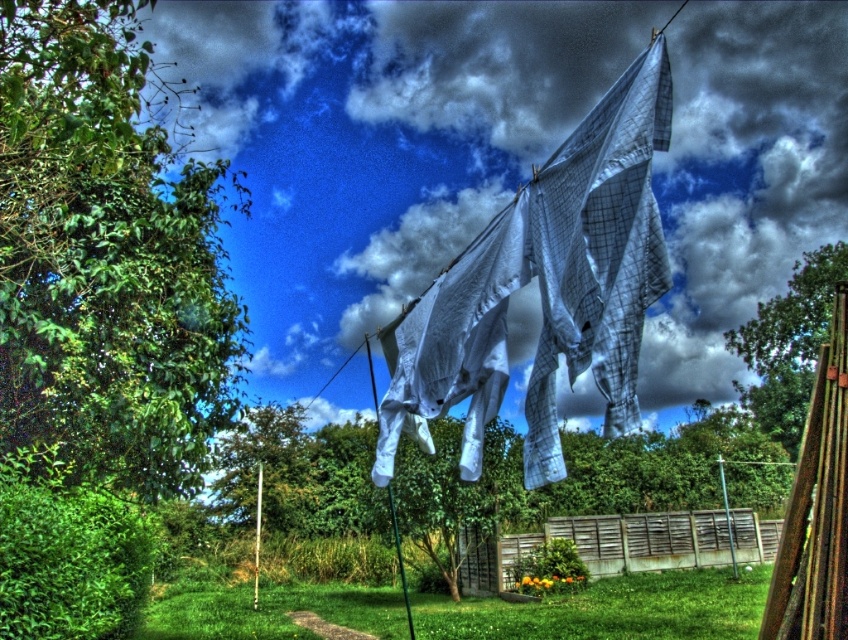
Is green leafy tree at left further to the viewer compared to green grass at lower center?

No, green leafy tree at left is in front of green grass at lower center.

Is green leafy tree at left positioned before green grass at lower center?

Yes, it is in front of green grass at lower center.

Which is in front, point (233, 307) or point (215, 614)?

Point (233, 307) is more forward.

Find the location of a particular element. The image size is (848, 640). green leafy tree at left is located at coordinates 106,259.

Between green leafy tree at left and white quilted fabric at center, which one appears on the right side from the viewer's perspective?

From the viewer's perspective, white quilted fabric at center appears more on the right side.

Is green leafy tree at left bigger than white quilted fabric at center?

Correct, green leafy tree at left is larger in size than white quilted fabric at center.

Does point (155, 378) come in front of point (604, 342)?

No, (155, 378) is behind (604, 342).

At what (x,y) coordinates should I click in order to perform the action: click on green leafy tree at left. Please return your answer as a coordinate pair (x, y). This screenshot has height=640, width=848. Looking at the image, I should click on (106, 259).

Is white quilted fabric at center above green grass at lower center?

Correct, white quilted fabric at center is located above green grass at lower center.

Consider the image. Can you confirm if white quilted fabric at center is shorter than green grass at lower center?

Yes, white quilted fabric at center is shorter than green grass at lower center.

Locate an element on the screen. The height and width of the screenshot is (640, 848). white quilted fabric at center is located at coordinates (544, 288).